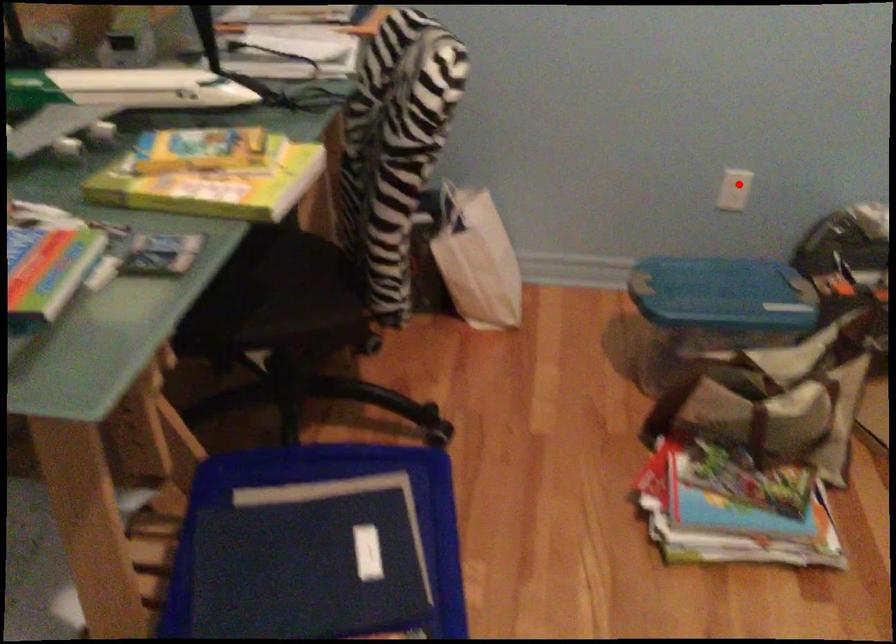
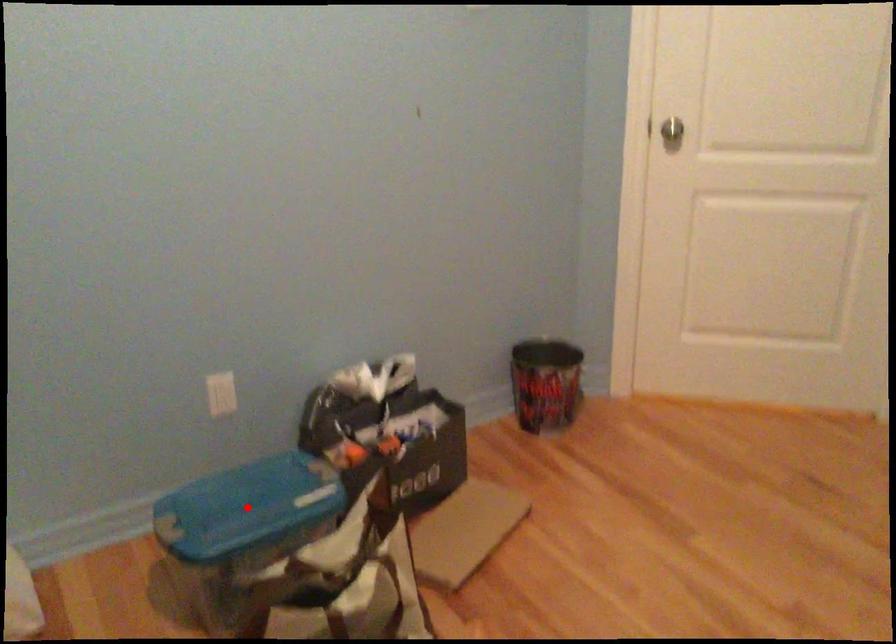
I am providing you with two images of the same scene from different viewpoints. A red point is marked on the first image and another point is marked on the second image. Is the red point in image1 aligned with the point shown in image2?

No